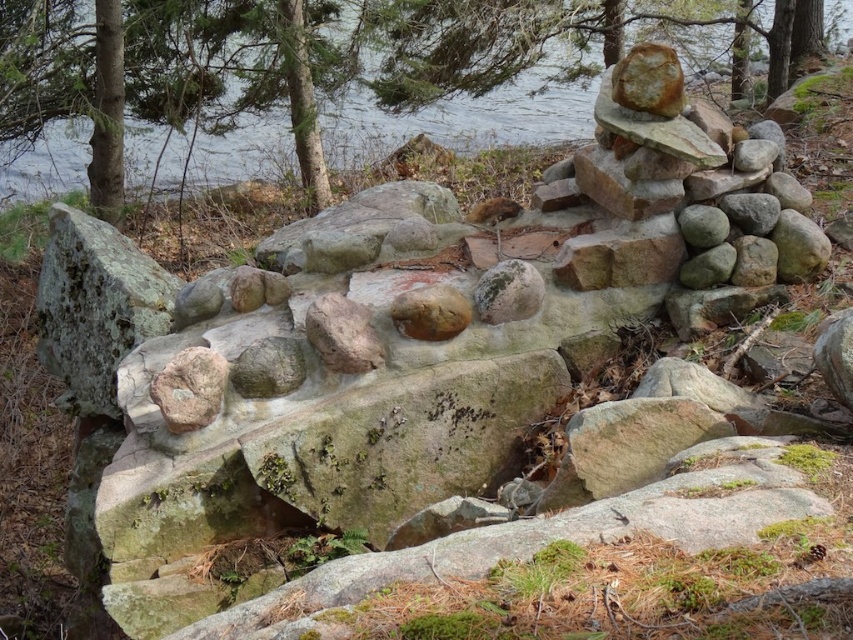
Locate an element on the screen. The image size is (853, 640). smooth gray rock at center is located at coordinates (341, 333).

From the picture: How far apart are smooth gray rock at center and mossy rock at center?

A distance of 13.83 inches exists between smooth gray rock at center and mossy rock at center.

Which is in front, point (350, 346) or point (525, 288)?

Point (350, 346) is more forward.

The width and height of the screenshot is (853, 640). I want to click on smooth gray rock at center, so click(x=341, y=333).

Is green mossy tree at upper center in front of rusty brown rock at center?

No, it is not.

Is point (314, 176) positioned behind point (152, 401)?

Yes, point (314, 176) is behind point (152, 401).

Locate an element on the screen. This screenshot has width=853, height=640. green mossy tree at upper center is located at coordinates (302, 104).

Between green mossy rock at upper center and rusty metallic rock at center, which one appears on the right side from the viewer's perspective?

From the viewer's perspective, green mossy rock at upper center appears more on the right side.

The height and width of the screenshot is (640, 853). Find the location of `green mossy rock at upper center`. green mossy rock at upper center is located at coordinates (466, 115).